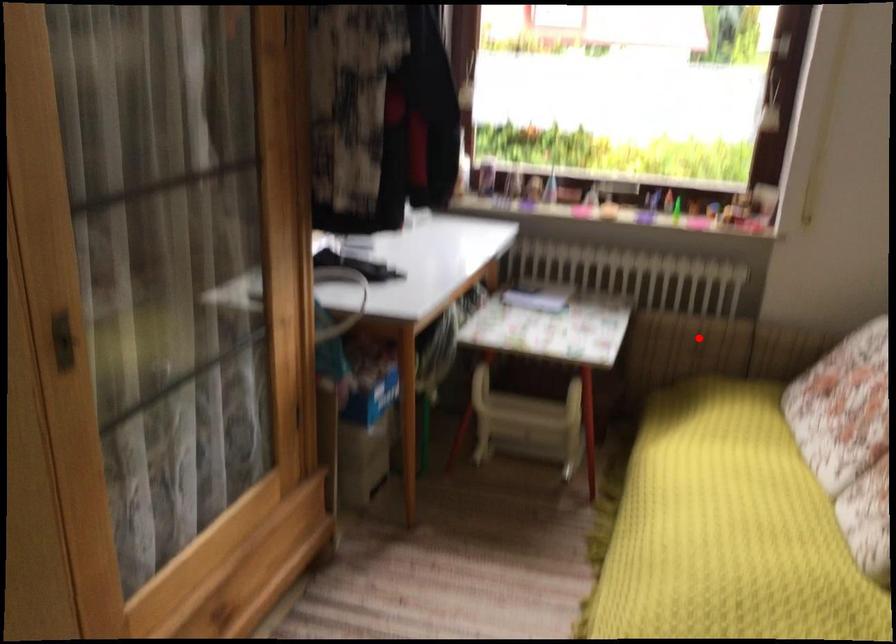
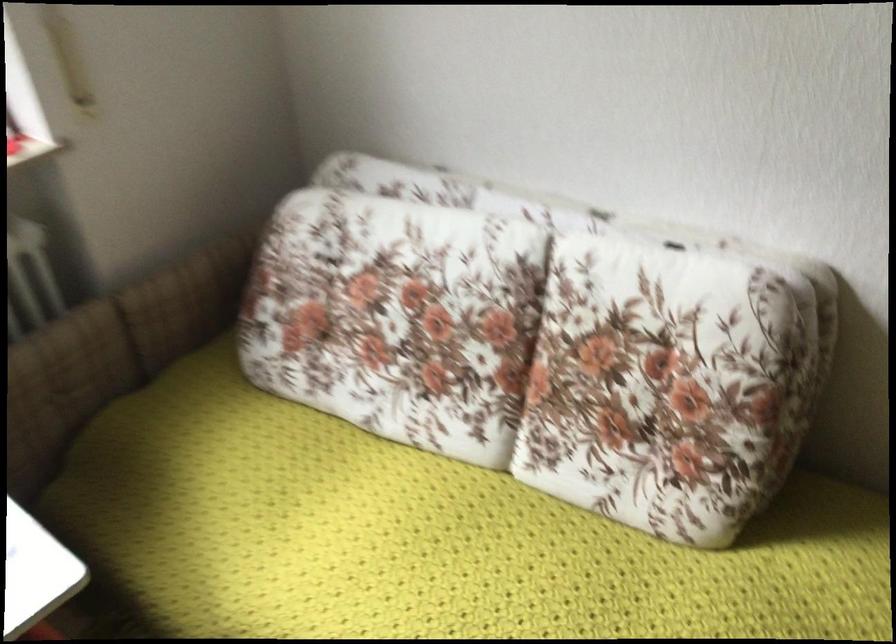
Locate, in the second image, the point that corresponds to the highlighted location in the first image.

(63, 384)